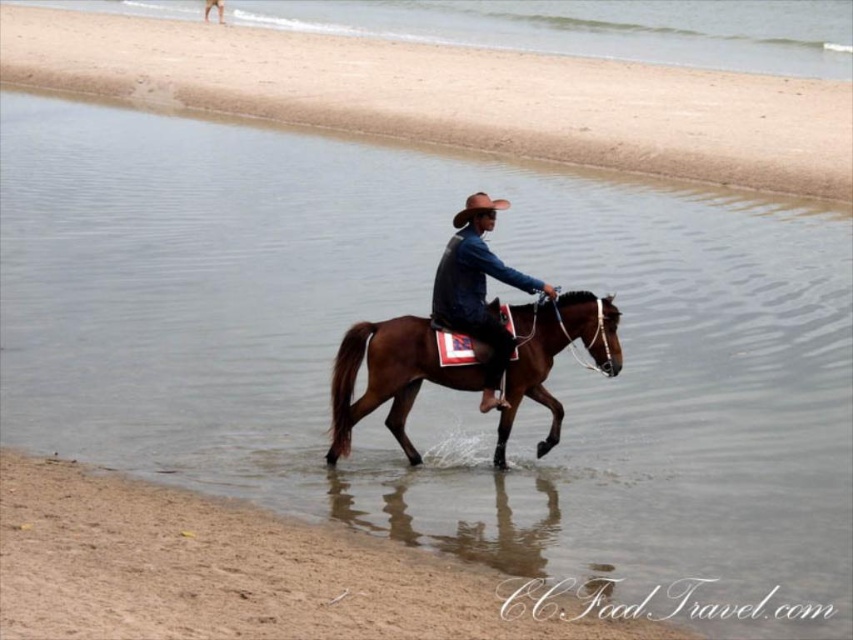
Question: Which object is closer to the camera taking this photo?

Choices:
 (A) shiny brown leather cowboy hat at center
 (B) brown glossy horse at center
 (C) brown leather cowboy hat at center

Answer: (C)

Question: From the image, what is the correct spatial relationship of sandy beach at lower center in relation to brown glossy horse at center?

Choices:
 (A) left
 (B) right

Answer: (A)

Question: Does brown sandy beach at lower left lie in front of brown leather cowboy hat at center?

Choices:
 (A) yes
 (B) no

Answer: (A)

Question: Which is farther from the brown sandy beach at lower left?

Choices:
 (A) brown glossy horse at center
 (B) shiny brown leather cowboy hat at center
 (C) sandy beach at lower center

Answer: (C)

Question: Can you confirm if sandy beach at lower center is thinner than brown leather cowboy hat at center?

Choices:
 (A) yes
 (B) no

Answer: (B)

Question: Which point is farther to the camera?

Choices:
 (A) (462, 300)
 (B) (239, 33)

Answer: (B)